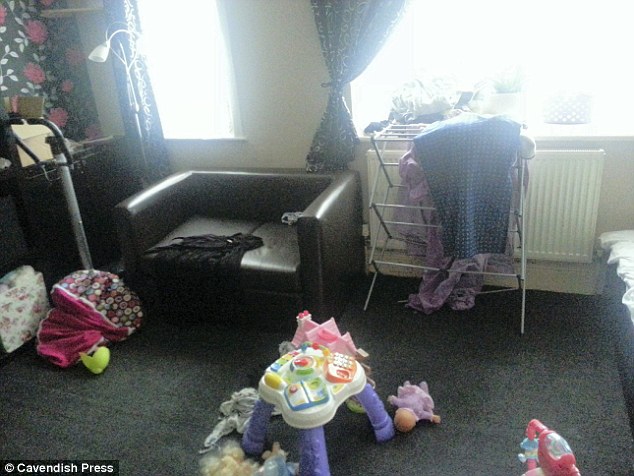
Find the location of `window`. window is located at coordinates (188, 78), (444, 41).